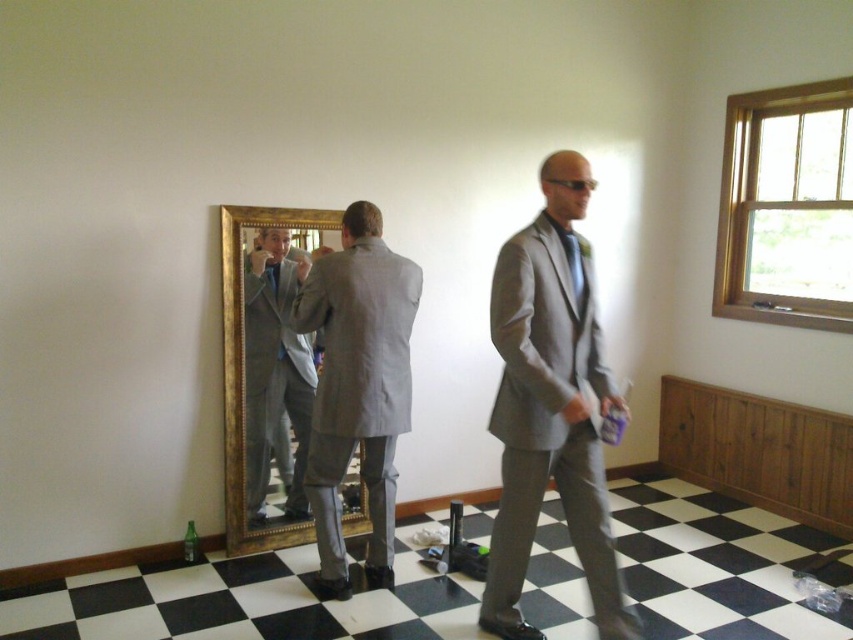
Is matte gray suit at center taller than green silk tie at center?

Yes.

Between matte gray suit at center and green silk tie at center, which one is positioned lower?

Positioned lower is matte gray suit at center.

The height and width of the screenshot is (640, 853). Describe the element at coordinates (550, 410) in the screenshot. I see `matte gray suit at center` at that location.

I want to click on matte gray suit at center, so click(x=550, y=410).

Where is `matte gray suit at center`? matte gray suit at center is located at coordinates (550, 410).

Is matte gray suit at center to the right of gray matte suit at center from the viewer's perspective?

Correct, you'll find matte gray suit at center to the right of gray matte suit at center.

Which is in front, point (570, 337) or point (281, 264)?

Point (570, 337) is more forward.

The image size is (853, 640). Find the location of `matte gray suit at center`. matte gray suit at center is located at coordinates (550, 410).

Does matte gray suit at center appear on the right side of gold-framed mirror at center?

Yes, matte gray suit at center is to the right of gold-framed mirror at center.

Which is in front, point (535, 369) or point (234, 365)?

Point (535, 369) is in front.

Is point (527, 435) farther from viewer compared to point (231, 205)?

No, it is in front of (231, 205).

This screenshot has height=640, width=853. Find the location of `matte gray suit at center`. matte gray suit at center is located at coordinates pyautogui.click(x=550, y=410).